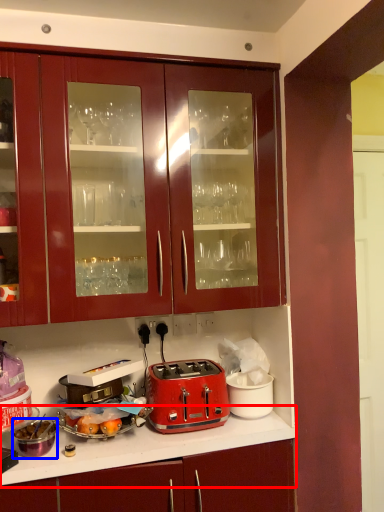
Question: Which of the following is the closest to the observer, countertop (highlighted by a red box) or appliance (highlighted by a blue box)?

Choices:
 (A) countertop
 (B) appliance

Answer: (A)